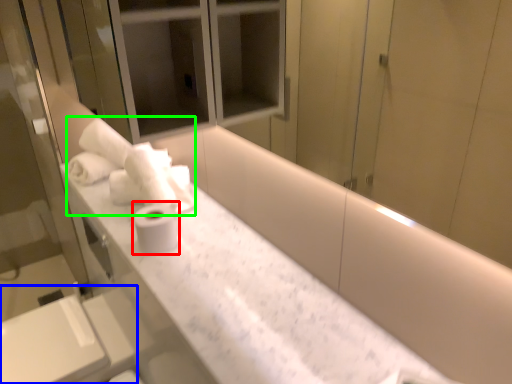
Question: Based on their relative distances, which object is farther from toilet paper (highlighted by a red box)? Choose from sink (highlighted by a blue box) and bath towel (highlighted by a green box).

Choices:
 (A) sink
 (B) bath towel

Answer: (A)